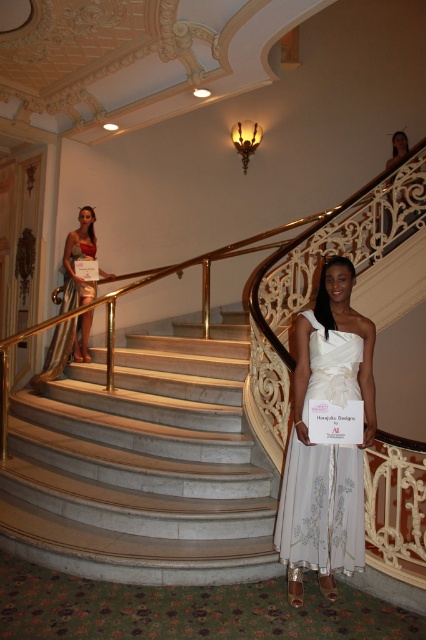
Question: Is white marble stairs at center further to camera compared to white satin dress at center?

Choices:
 (A) yes
 (B) no

Answer: (A)

Question: Which object is positioned farthest from the white marble stairs at center?

Choices:
 (A) gold metallic dress at upper left
 (B) white satin dress at center

Answer: (A)

Question: Is white satin dress at center behind gold metallic dress at upper left?

Choices:
 (A) yes
 (B) no

Answer: (B)

Question: Which object is closer to the camera taking this photo?

Choices:
 (A) white satin dress at center
 (B) white marble stairs at center
 (C) gold metallic dress at upper left
 (D) shiny gold dress at upper left

Answer: (A)

Question: Is white marble stairs at center positioned at the back of shiny gold dress at upper left?

Choices:
 (A) no
 (B) yes

Answer: (A)

Question: Which object is closer to the camera taking this photo?

Choices:
 (A) gold metallic dress at upper left
 (B) shiny gold dress at upper left
 (C) white satin dress at center
 (D) white marble stairs at center

Answer: (C)